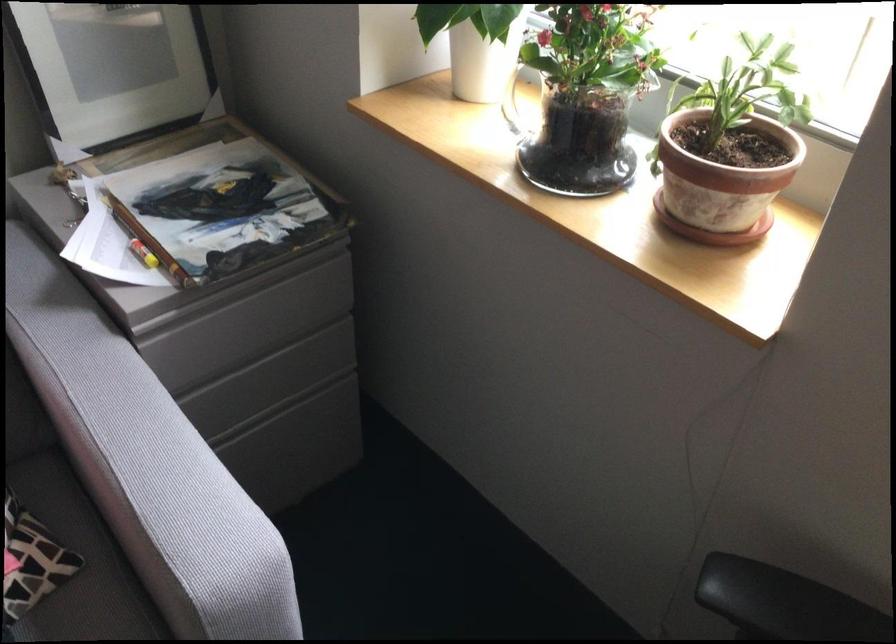
Where would you resting arm on the black chair armrest? Please return your answer as a coordinate pair (x, y).

(784, 603)